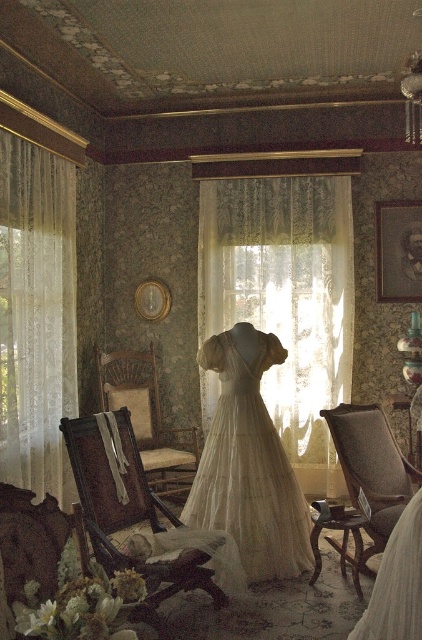
You are an interior designer planning to replace the white lace curtains in this vintage room. You need to know which curtain has a greater width to ensure proper measurements for the new ones. Which one is wider between the white lace curtain at center and the white lace curtain at left?

The white lace curtain at center is wider than the white lace curtain at left according to the description.

You are a interior designer planning to place a new sofa in this vintage room. The sofa is the same size as the brown woven armchair at center. You want to place it where the white lace curtain at center currently is. Will the sofa fit in that space?

The white lace curtain at center has a smaller size compared to brown woven armchair at center. Since the sofa is the same size as the brown woven armchair at center, it will not fit in the space currently occupied by the white lace curtain at center because the curtain area is smaller.